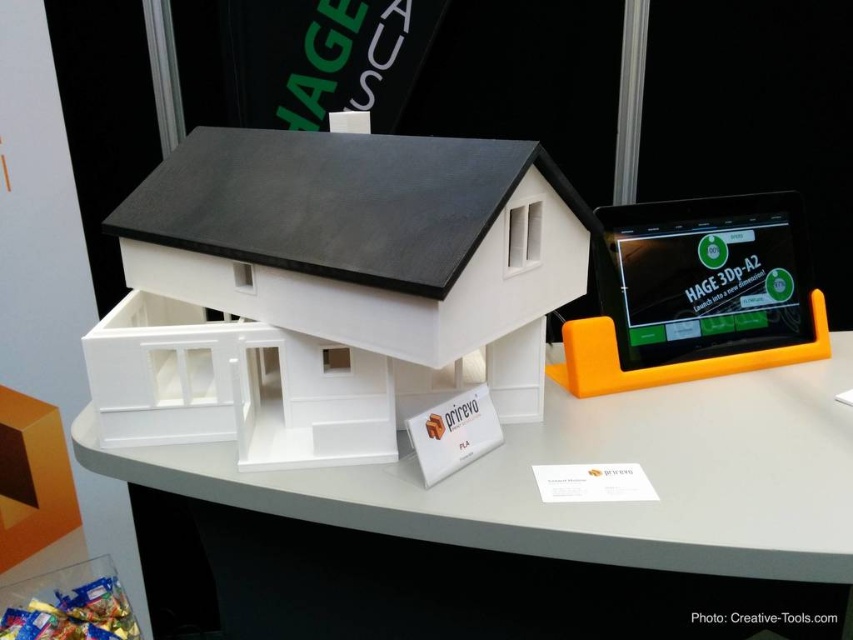
You are a delivery person who needs to place a small package on the surface closest to you between the white matte table at center and the matte black tablet at right. Which surface should you choose?

The white matte table at center is in front of the matte black tablet at right, so it is closer to you. Place the package on the white matte table at center.

You are standing in front of the 3D house model and want to reach a point that is exactly 1.16 meters away from your current position. Can you determine if the point at coordinates point (811,400) is within the area of the house model?

The point (811,400) is 1.16 meters away from the camera, so it is within the area of the house model since the house model is the main object in the scene.

You are looking at the 3D house model and notice two points marked in the image. The first point is at coordinates point (x=190, y=486) and the second is at point (x=759, y=278). Which point is closer to your eyes?

→ Point (x=190, y=486) is closer to the camera than point (x=759, y=278).